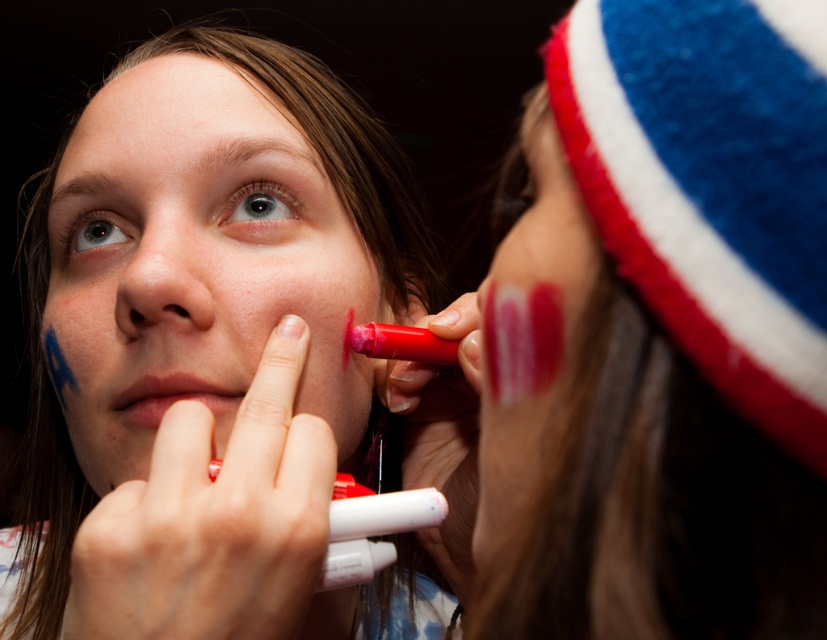
Does matte pink marker at lower left appear on the right side of matte pink paint at right?

In fact, matte pink marker at lower left is to the left of matte pink paint at right.

Between matte pink marker at lower left and matte pink paint at right, which one is positioned higher?

matte pink marker at lower left is higher up.

Which is in front, point (130, 102) or point (565, 406)?

Point (565, 406) is more forward.

At what (x,y) coordinates should I click in order to perform the action: click on matte pink marker at lower left. Please return your answer as a coordinate pair (x, y). Looking at the image, I should click on (194, 264).

The height and width of the screenshot is (640, 827). Describe the element at coordinates (520, 339) in the screenshot. I see `matte red lipstick at lower right` at that location.

Which is in front, point (545, 332) or point (177, 321)?

Point (545, 332)

Find the location of `matte red lipstick at lower right`. matte red lipstick at lower right is located at coordinates (520, 339).

This screenshot has height=640, width=827. In order to click on matte red lipstick at lower right in this screenshot , I will do `click(520, 339)`.

From the picture: Is matte red marker at right wider than matte skin nose at center?

Yes, matte red marker at right is wider than matte skin nose at center.

Can you confirm if matte red marker at right is taller than matte skin nose at center?

Correct, matte red marker at right is much taller as matte skin nose at center.

Is point (692, 324) positioned in front of point (132, 276)?

Yes, it is in front of point (132, 276).

I want to click on matte red marker at right, so click(x=658, y=333).